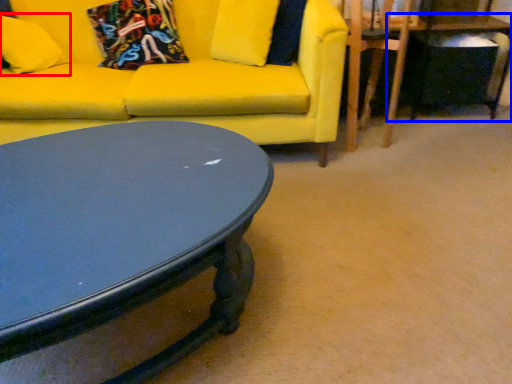
Question: Which of the following is the farthest to the observer, pillow (highlighted by a red box) or table (highlighted by a blue box)?

Choices:
 (A) pillow
 (B) table

Answer: (B)